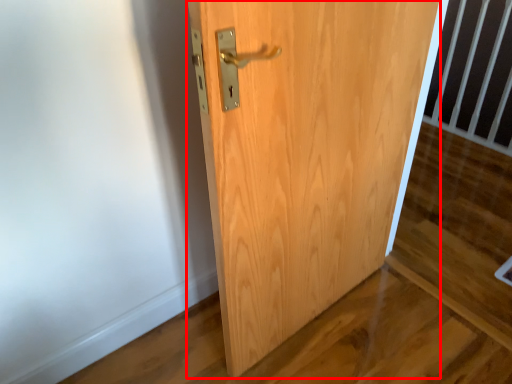
Question: From the image's perspective, where is door (annotated by the red box) located relative to balustrade?

Choices:
 (A) above
 (B) below

Answer: (B)